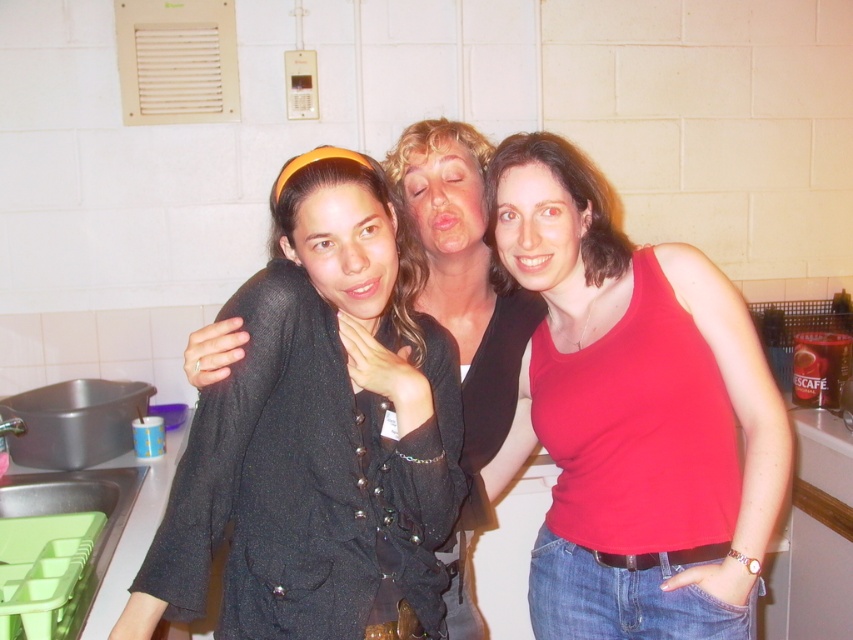
Is black textured jacket at center above red matte tank top at center?

No, black textured jacket at center is not above red matte tank top at center.

Can you confirm if black textured jacket at center is smaller than red matte tank top at center?

Yes, black textured jacket at center is smaller than red matte tank top at center.

Where is `black textured jacket at center`? black textured jacket at center is located at coordinates (317, 433).

Identify the location of black textured jacket at center. (317, 433).